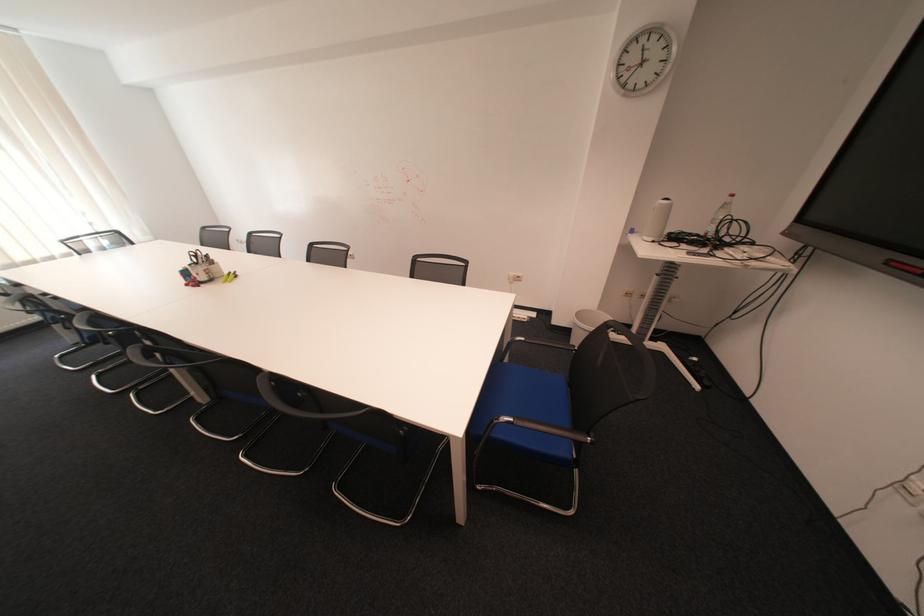
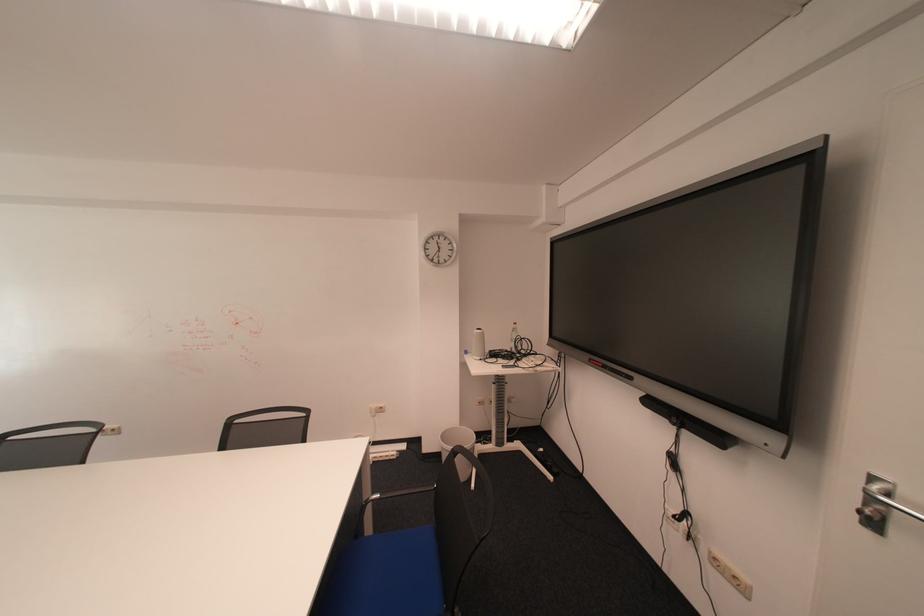
Where in the second image is the point corresponding to point 640,235 from the first image?

(477, 355)